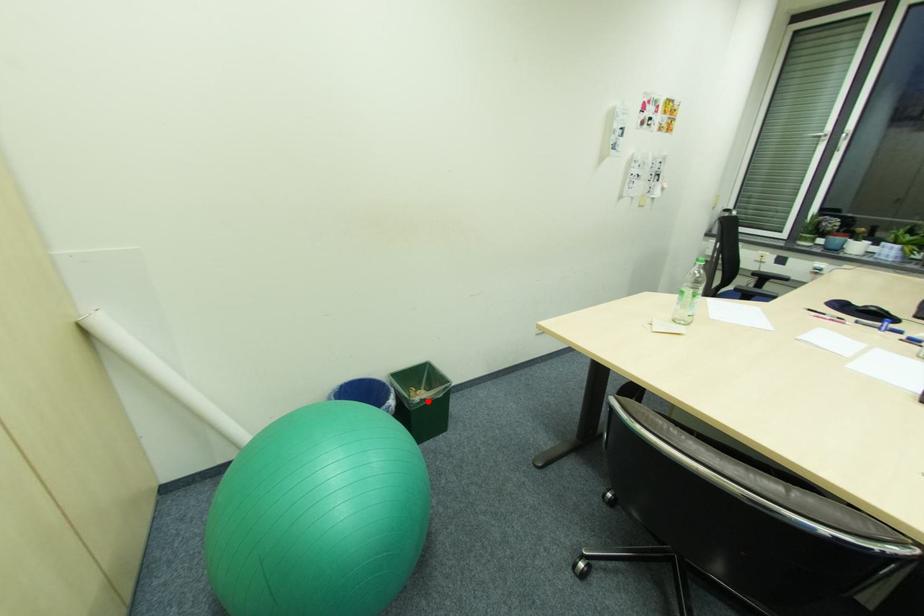
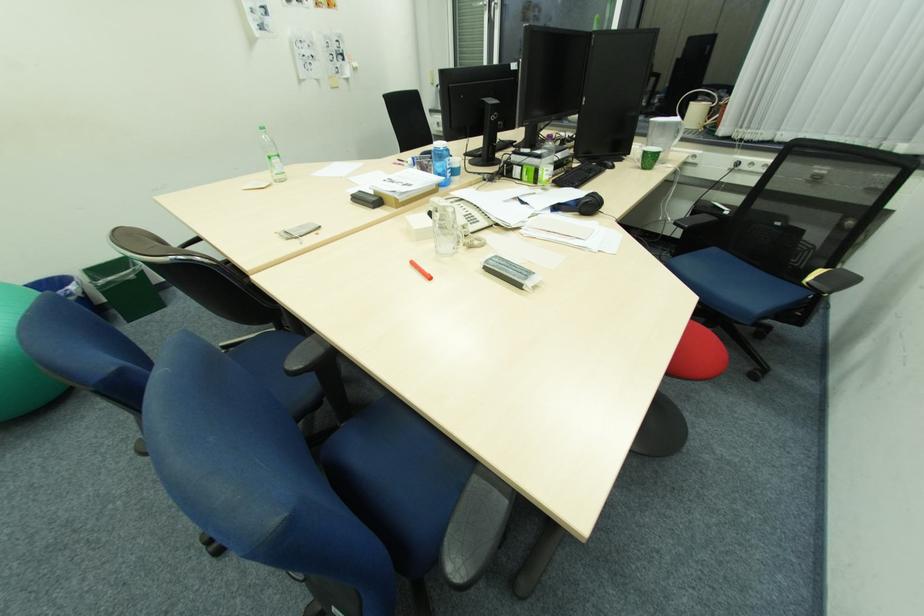
Question: I am providing you with two images of the same scene from different viewpoints. In image1, a red point is highlighted. Considering the same 3D point in image2, which of the following is correct?

Choices:
 (A) It is closer
 (B) It is farther

Answer: (B)